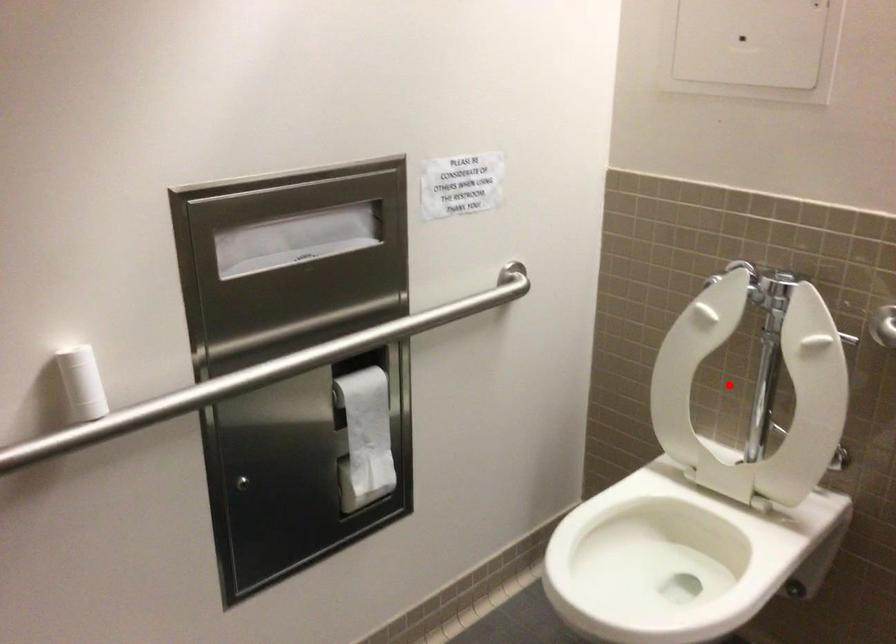
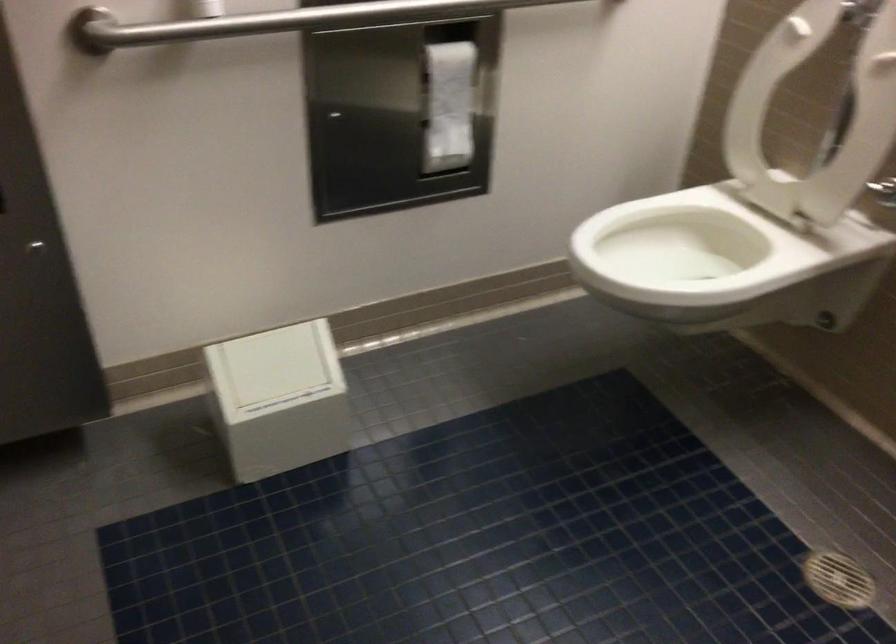
Find the pixel in the second image that matches the highlighted location in the first image.

(814, 115)